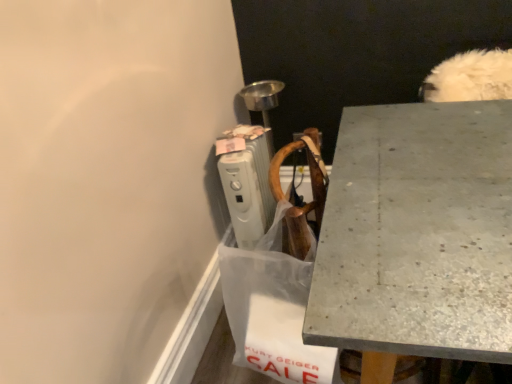
Question: Is transparent plastic shopping bag at lower center bigger or smaller than granite gray desk at upper right?

Choices:
 (A) big
 (B) small

Answer: (B)

Question: Looking at their shapes, would you say transparent plastic shopping bag at lower center is wider or thinner than granite gray desk at upper right?

Choices:
 (A) thin
 (B) wide

Answer: (A)

Question: Which is nearer to the white plastic radiator at upper center?

Choices:
 (A) transparent plastic shopping bag at lower center
 (B) granite gray desk at upper right

Answer: (A)

Question: Estimate the real-world distances between objects in this image. Which object is closer to the white plastic radiator at upper center?

Choices:
 (A) granite gray desk at upper right
 (B) transparent plastic shopping bag at lower center

Answer: (B)